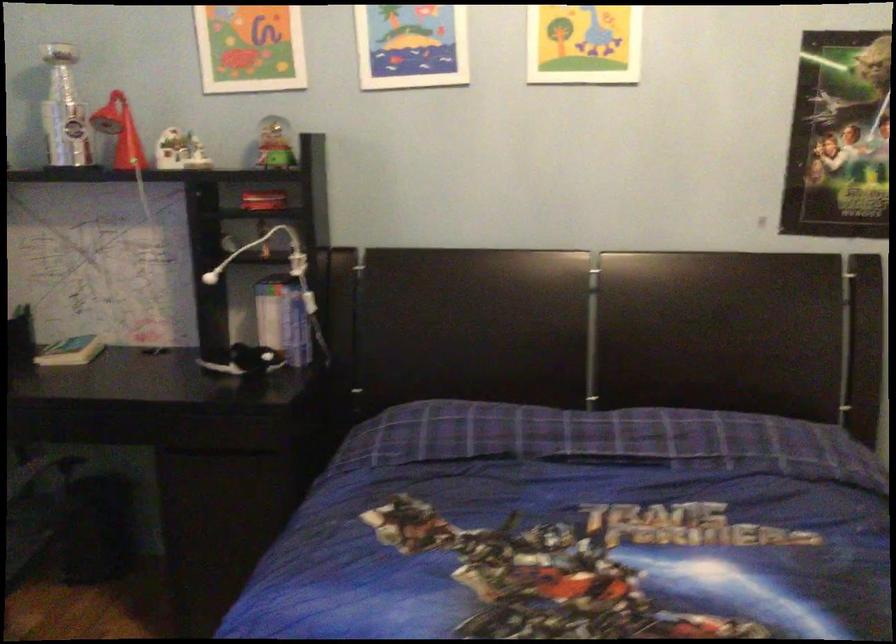
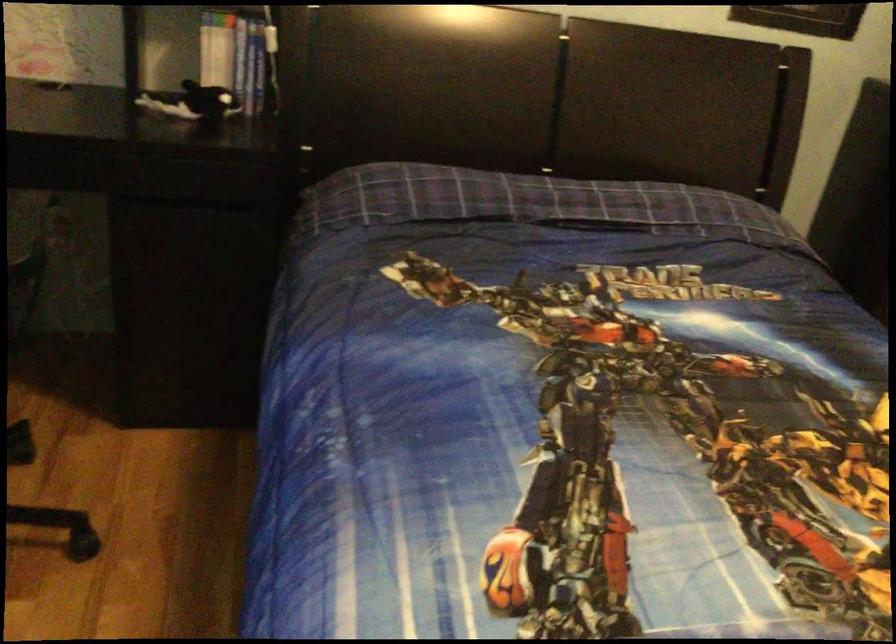
Question: The camera is either moving clockwise (left) or counter-clockwise (right) around the object. The first image is from the beginning of the video and the second image is from the end. Is the camera moving left or right when shooting the video?

Choices:
 (A) Left
 (B) Right

Answer: (A)